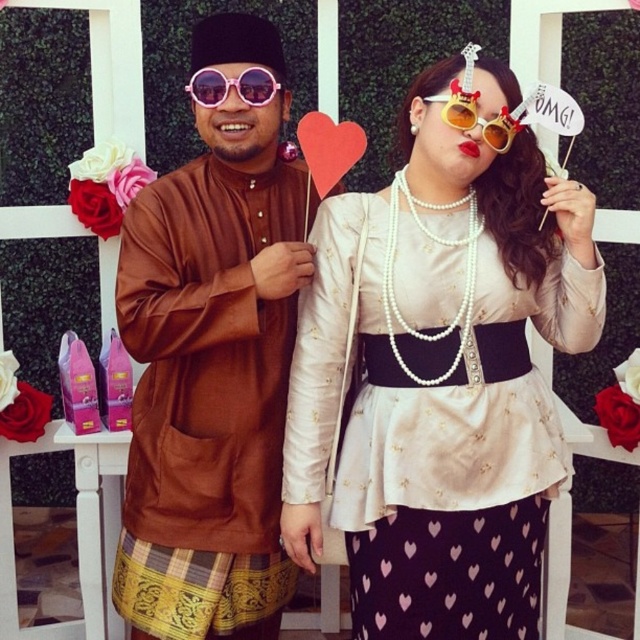
You are a photographer trying to capture a closeup of the pearl satin blouse at center and the gold plastic sunglasses at upper center. Which object should you focus on first if you want to ensure both are in focus without moving the camera?

The pearl satin blouse at center is positioned under the gold plastic sunglasses at upper center, so focusing on the gold plastic sunglasses at upper center first will ensure both are in focus since it is closer to the camera.

You are a photographer setting up for a group photo. You have two pairs of sunglasses, the gold plastic sunglasses at upper center and the pink reflective sunglasses at center. You need to place a 50 cm wide prop between them. Will there be enough space?

The gold plastic sunglasses at upper center and pink reflective sunglasses at center are 50.18 centimeters apart. Since the prop is 50 cm wide, there will be enough space between them to place the prop.